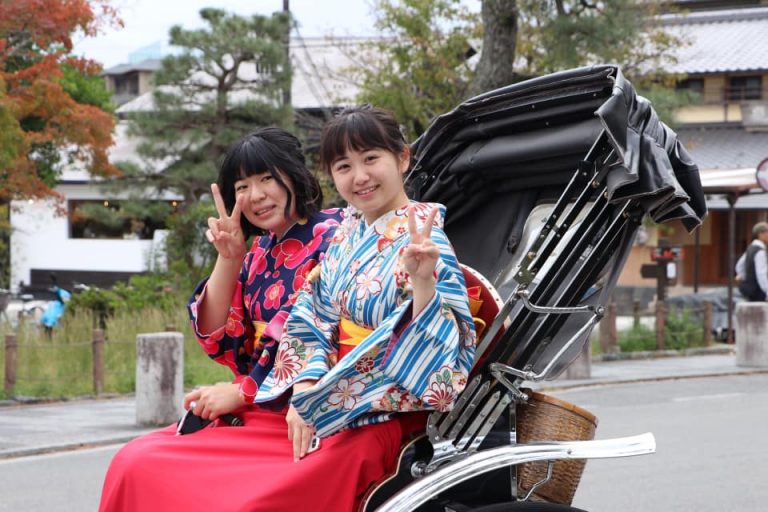
Find the location of a particular element. red blanket is located at coordinates (256, 469).